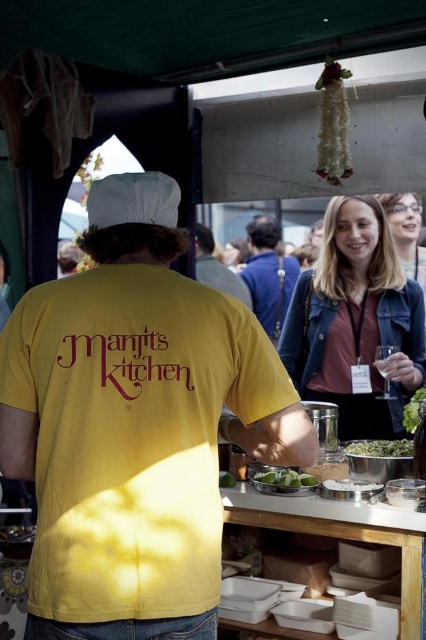
Can you confirm if yellow fabric shirt at center is positioned to the right of denim jacket at upper right?

Incorrect, yellow fabric shirt at center is not on the right side of denim jacket at upper right.

Is yellow fabric shirt at center closer to camera compared to denim jacket at upper right?

Yes, it is.

Is point (209, 429) behind point (321, 298)?

That is False.

In order to click on yellow fabric shirt at center in this screenshot , I will do `click(135, 424)`.

Consider the image. Is denim jacket at upper right to the right of blonde hair at upper center from the viewer's perspective?

Incorrect, denim jacket at upper right is not on the right side of blonde hair at upper center.

Which is above, denim jacket at upper right or blonde hair at upper center?

blonde hair at upper center is higher up.

I want to click on denim jacket at upper right, so click(x=356, y=323).

Find the location of a particular element. The width and height of the screenshot is (426, 640). denim jacket at upper right is located at coordinates (356, 323).

Is yellow fabric shirt at center below matte gray shirt at center?

Yes.

The image size is (426, 640). What do you see at coordinates (135, 424) in the screenshot? I see `yellow fabric shirt at center` at bounding box center [135, 424].

Locate an element on the screen. yellow fabric shirt at center is located at coordinates (135, 424).